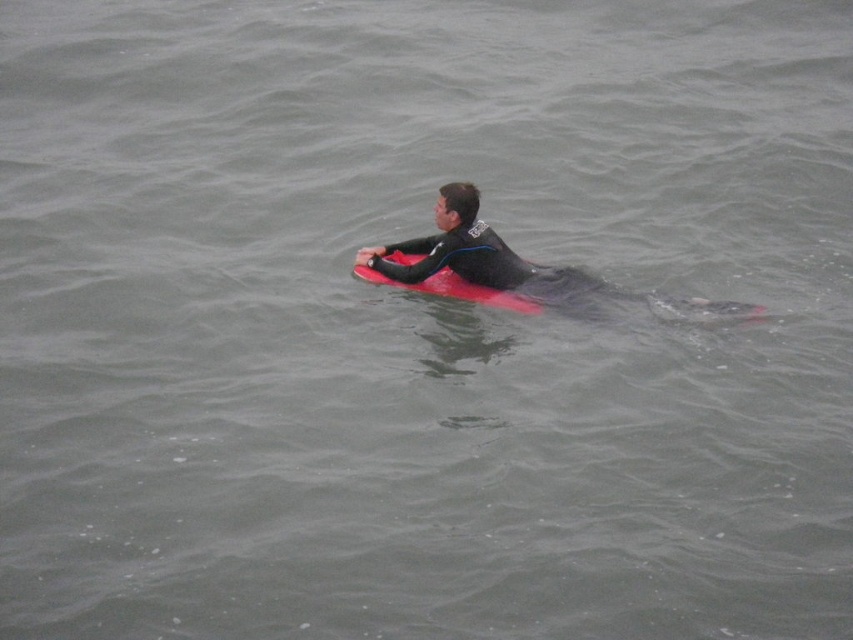
Question: Can you confirm if matte black wetsuit at center is positioned below rubber matte surfboard at center?

Choices:
 (A) no
 (B) yes

Answer: (A)

Question: Does matte black wetsuit at center have a lesser width compared to rubber matte surfboard at center?

Choices:
 (A) no
 (B) yes

Answer: (A)

Question: Among these objects, which one is nearest to the camera?

Choices:
 (A) matte black wetsuit at center
 (B) rubber matte surfboard at center

Answer: (A)

Question: Among these objects, which one is nearest to the camera?

Choices:
 (A) rubber matte surfboard at center
 (B) matte black wetsuit at center

Answer: (B)

Question: Is matte black wetsuit at center wider than rubber matte surfboard at center?

Choices:
 (A) no
 (B) yes

Answer: (B)